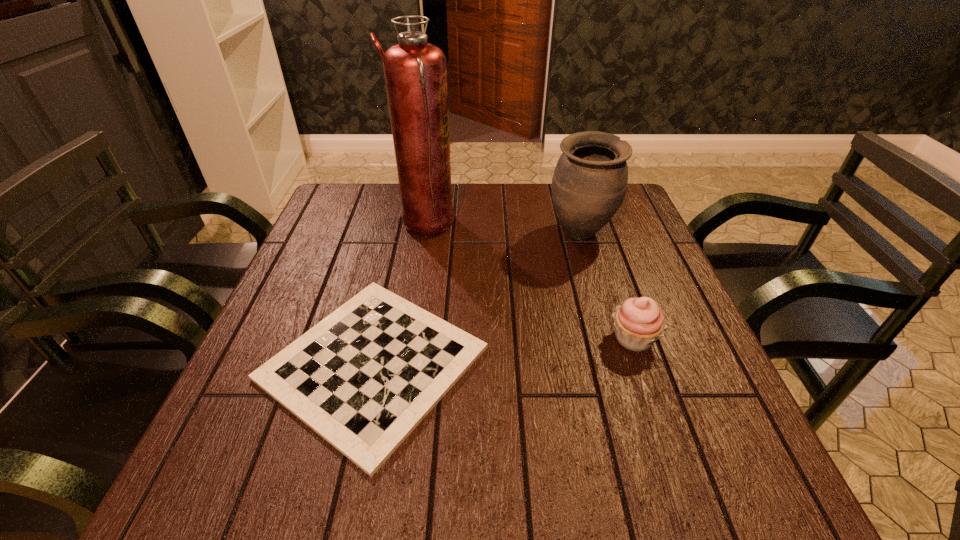
Image resolution: width=960 pixels, height=540 pixels. In the image, there is a desktop. Find the location of `vacant space at the far left corner`. vacant space at the far left corner is located at coordinates (335, 194).

The width and height of the screenshot is (960, 540). I want to click on vacant space that is in between the cupcake and the fire extinguisher, so click(529, 282).

At what (x,y) coordinates should I click in order to perform the action: click on free space between the checkerboard and the third tallest object. Please return your answer as a coordinate pair (x, y). Looking at the image, I should click on (503, 351).

This screenshot has height=540, width=960. Find the location of `free space between the urn and the tallest object`. free space between the urn and the tallest object is located at coordinates (503, 230).

The height and width of the screenshot is (540, 960). What are the coordinates of `empty space that is in between the third shortest object and the checkerboard` in the screenshot? It's located at (476, 299).

In order to click on free space between the third tallest object and the fire extinguisher in this screenshot , I will do `click(529, 282)`.

Identify the location of unoccupied area between the tallest object and the shortest object. (399, 294).

This screenshot has width=960, height=540. What are the coordinates of `vacant point located between the fire extinguisher and the cupcake` in the screenshot? It's located at (529, 282).

Where is `unoccupied area between the third tallest object and the shortest object`? unoccupied area between the third tallest object and the shortest object is located at coordinates (503, 351).

Identify the location of free space between the checkerboard and the third shortest object. The width and height of the screenshot is (960, 540). (476, 299).